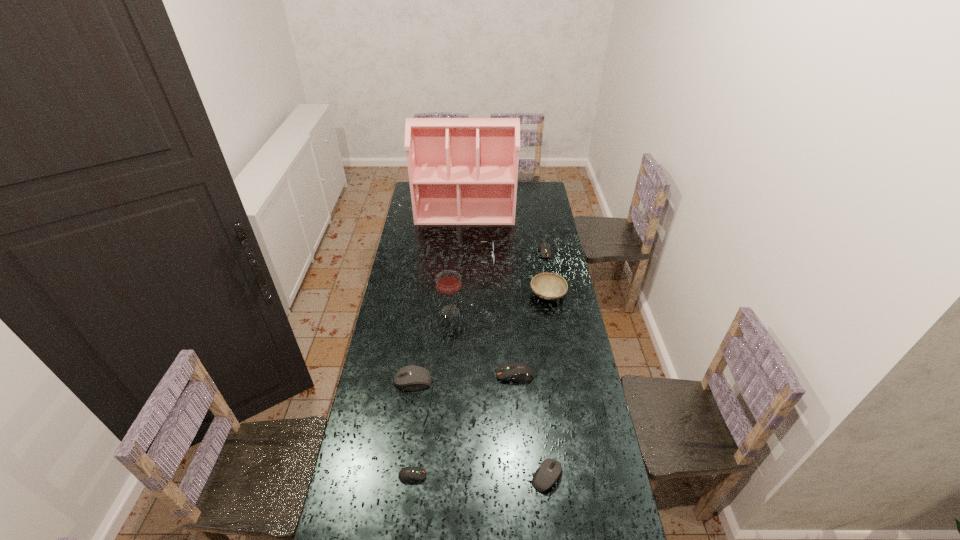
This screenshot has height=540, width=960. Find the location of `free space between the tallest object and the spectacles`. free space between the tallest object and the spectacles is located at coordinates point(471,235).

What are the coordinates of `vacant space that's between the gray bowl and the second farthest dark computer equipment` in the screenshot? It's located at (532, 335).

At what (x,y) coordinates should I click in order to perform the action: click on vacant region between the tallest object and the farthest dark computer equipment. Please return your answer as a coordinate pair (x, y). This screenshot has height=540, width=960. Looking at the image, I should click on (505, 233).

Identify the location of free space between the spectacles and the second farthest dark computer equipment. The width and height of the screenshot is (960, 540). (496, 316).

Identify the location of empty space that is in between the bowl and the tallest object. (507, 254).

The image size is (960, 540). Find the location of `object identified as the fifth closest to the left black computer equipment`. object identified as the fifth closest to the left black computer equipment is located at coordinates (548, 286).

Point out which object is positioned as the sixth nearest to the gray bowl. Please provide its 2D coordinates. Your answer should be formatted as a tuple, i.e. [(x, y)], where the tuple contains the x and y coordinates of a point satisfying the conditions above.

[(413, 377)]

You are a GUI agent. You are given a task and a screenshot of the screen. Output one action in this format:
    pyautogui.click(x=<x>, y=<y>)
    Task: Click on the third closest computer equipment to the spectacles
    The height and width of the screenshot is (540, 960).
    Given the screenshot: What is the action you would take?
    pyautogui.click(x=413, y=377)

Select which computer equipment is the third closest to the shortest computer equipment. Please provide its 2D coordinates. Your answer should be formatted as a tuple, i.e. [(x, y)], where the tuple contains the x and y coordinates of a point satisfying the conditions above.

[(518, 372)]

Identify the location of dark computer equipment that is the third closest to the black spectacles. (408, 474).